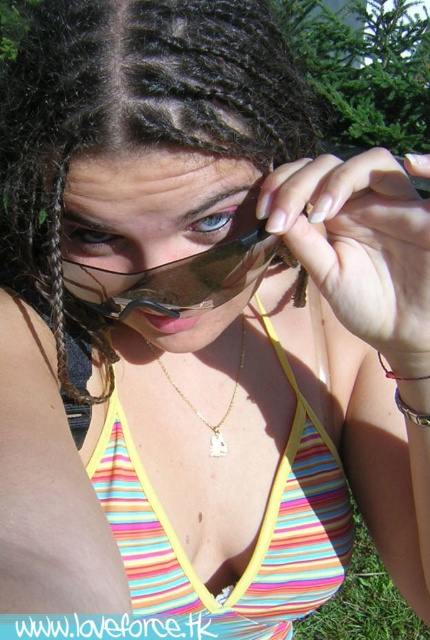
Question: Which object is closer to the camera taking this photo?

Choices:
 (A) red string bracelet at lower right
 (B) green grass at lower right
 (C) black braids at center

Answer: (C)

Question: Which of the following is the farthest from the observer?

Choices:
 (A) black braids at center
 (B) red string bracelet at lower right
 (C) multicolored striped bikini top at center
 (D) matte black goggles at center

Answer: (C)

Question: Does black braids at center have a larger size compared to red string bracelet at lower right?

Choices:
 (A) no
 (B) yes

Answer: (B)

Question: Is blue matte eye at center closer to the viewer compared to red string bracelet at lower right?

Choices:
 (A) no
 (B) yes

Answer: (B)

Question: Observing the image, what is the correct spatial positioning of matte black goggles at center in reference to brown braided hair at upper left?

Choices:
 (A) below
 (B) above

Answer: (B)

Question: Which point is farther to the camera?

Choices:
 (A) gold chain with pendant at center
 (B) bluematteeye at upper center
 (C) matte black goggles at center
 (D) brown braided hair at upper left

Answer: (A)